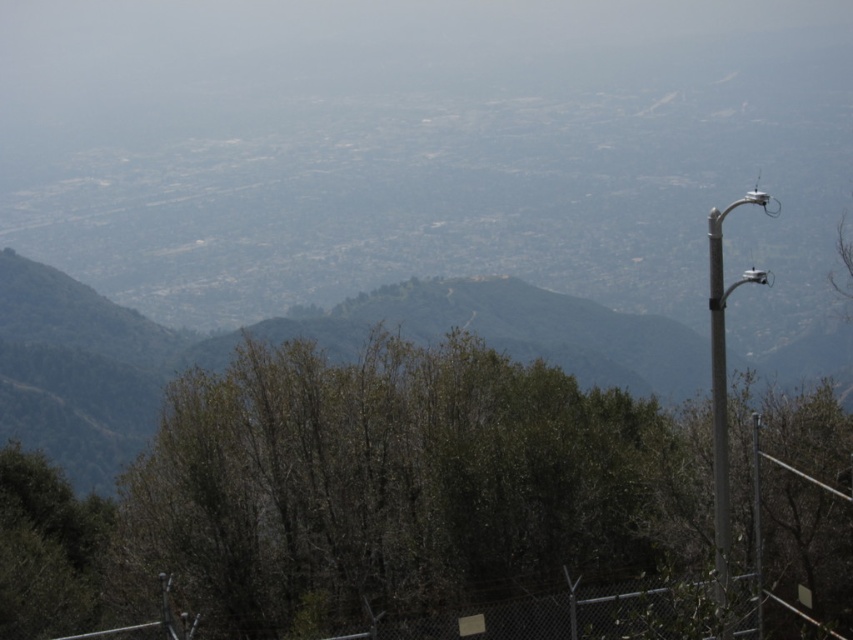
Which is in front, point (22, 595) or point (468, 634)?

Point (468, 634) is more forward.

Is point (131, 474) in front of point (67, 627)?

No.

Is point (650, 492) behind point (645, 628)?

Yes, it is.

In order to click on green leafy tree at center in this screenshot , I will do `click(358, 496)`.